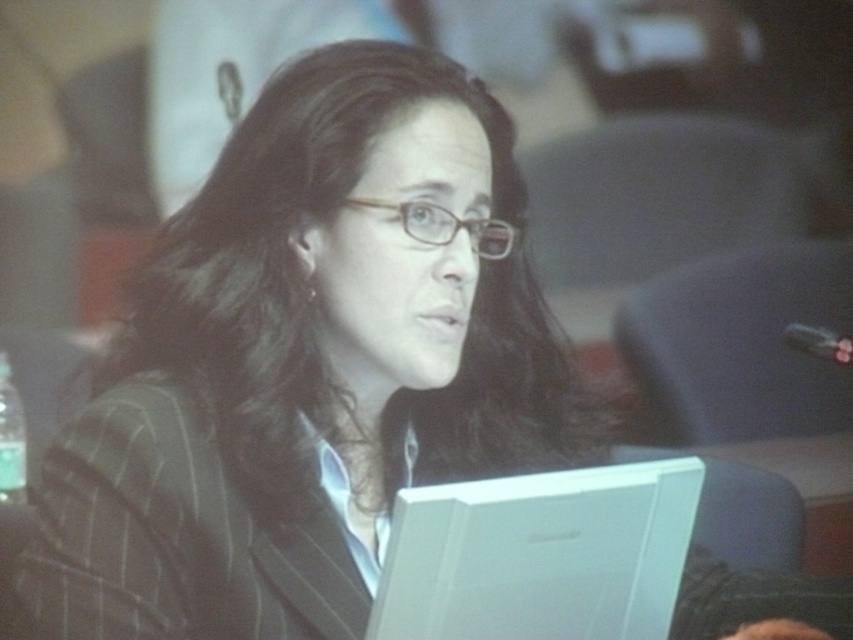
Measure the distance between point (x=241, y=172) and camera.

The distance of point (x=241, y=172) from camera is 3.29 feet.

Who is taller, dark brown silky hair at center or striped wool business suit at center?

dark brown silky hair at center

Between point (428, 422) and point (70, 435), which one is positioned in front?

Point (70, 435)

Where is `dark brown silky hair at center`? The height and width of the screenshot is (640, 853). dark brown silky hair at center is located at coordinates (328, 312).

Does dark brown silky hair at center have a greater width compared to clear plastic glasses at center?

Yes, dark brown silky hair at center is wider than clear plastic glasses at center.

Who is more distant from viewer, (167,300) or (430,218)?

The point (167,300) is behind.

I want to click on dark brown silky hair at center, so (x=328, y=312).

Who is lower down, white plastic laptop at lower center or clear plastic glasses at center?

Positioned lower is white plastic laptop at lower center.

Is point (618, 536) in front of point (347, 198)?

That is True.

Is point (521, 570) positioned before point (426, 241)?

Yes.

I want to click on white plastic laptop at lower center, so click(x=538, y=556).